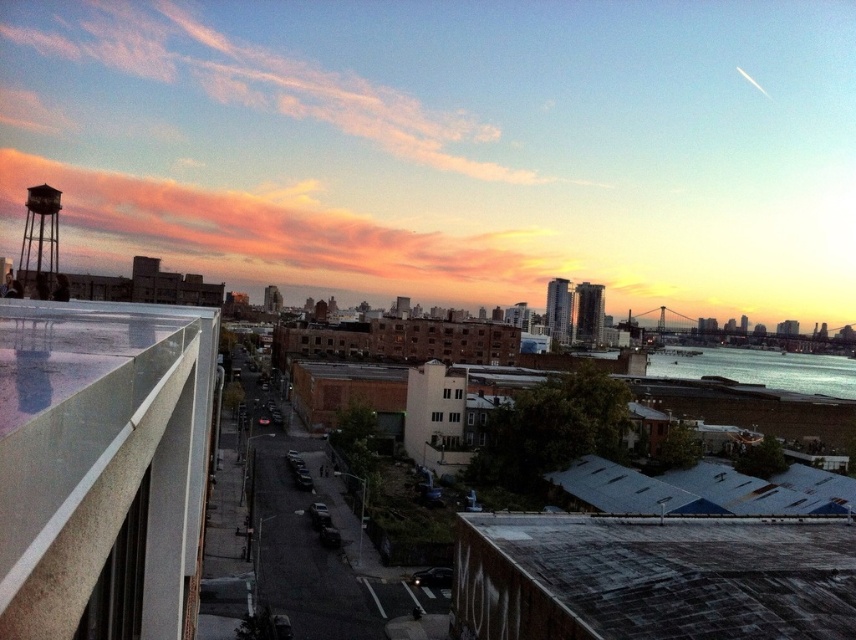
Question: Does transparent glass balcony at upper left lie behind blue water at lower right?

Choices:
 (A) no
 (B) yes

Answer: (A)

Question: Can you confirm if transparent glass balcony at upper left is thinner than metallic water tower at upper left?

Choices:
 (A) no
 (B) yes

Answer: (B)

Question: Which object appears farthest from the camera in this image?

Choices:
 (A) transparent glass balcony at upper left
 (B) blue water at lower right

Answer: (B)

Question: Does transparent glass balcony at upper left appear on the right side of blue water at lower right?

Choices:
 (A) yes
 (B) no

Answer: (B)

Question: Which point is farther from the camera taking this photo?

Choices:
 (A) (201, 476)
 (B) (774, 371)
 (C) (33, 244)

Answer: (B)

Question: Based on their relative distances, which object is nearer to the metallic water tower at upper left?

Choices:
 (A) transparent glass balcony at upper left
 (B) blue water at lower right

Answer: (A)